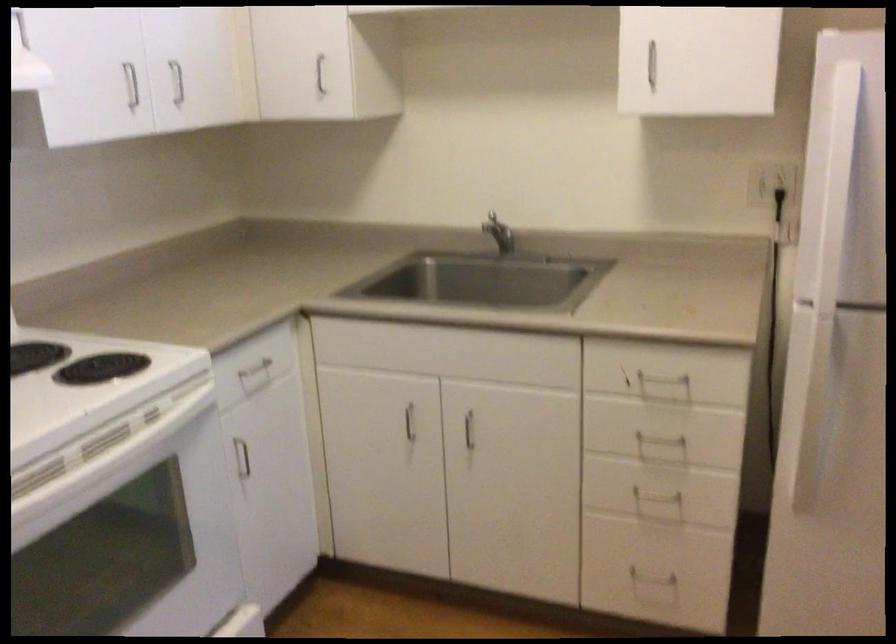
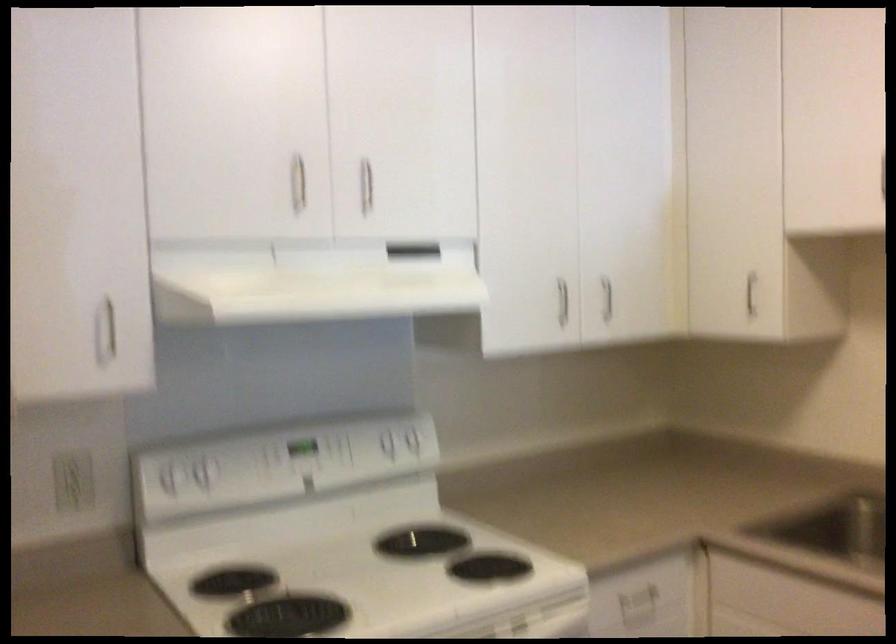
In the second image, find the point that corresponds to pixel 314 71 in the first image.

(751, 292)